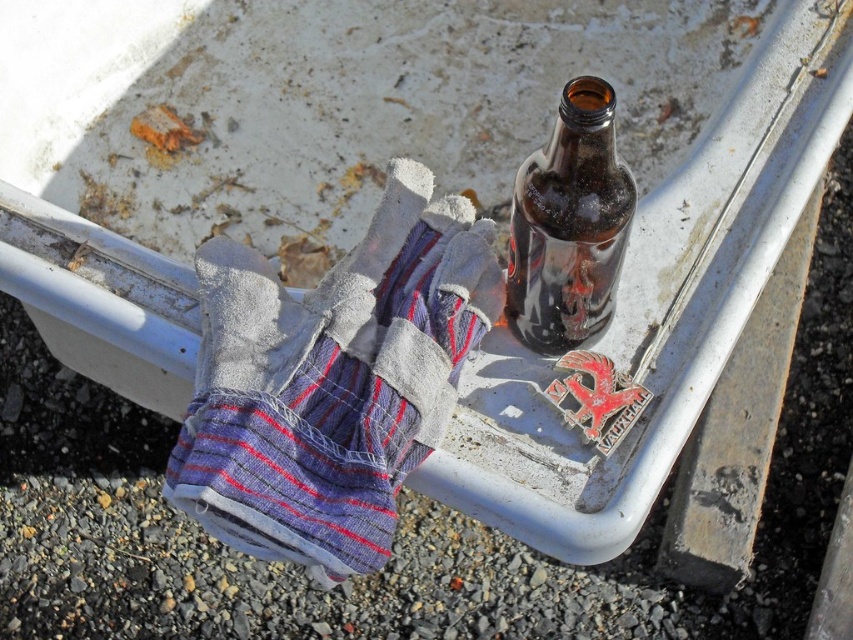
Question: Which point is farther to the camera?

Choices:
 (A) (233, 452)
 (B) (598, 332)

Answer: (B)

Question: Among these objects, which one is farthest from the camera?

Choices:
 (A) worn fabric glove at center
 (B) brown glass bottle at center

Answer: (A)

Question: Does worn fabric glove at center have a smaller size compared to brown glass bottle at center?

Choices:
 (A) yes
 (B) no

Answer: (B)

Question: Is worn fabric glove at center wider than brown glass bottle at center?

Choices:
 (A) yes
 (B) no

Answer: (A)

Question: Observing the image, what is the correct spatial positioning of worn fabric glove at center in reference to brown glass bottle at center?

Choices:
 (A) below
 (B) above

Answer: (A)